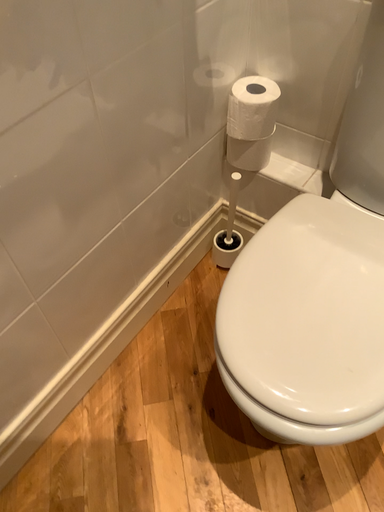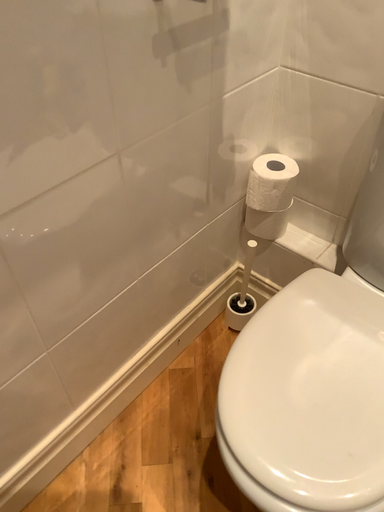
Question: Which way did the camera rotate in the video?

Choices:
 (A) rotated upward
 (B) rotated downward

Answer: (A)